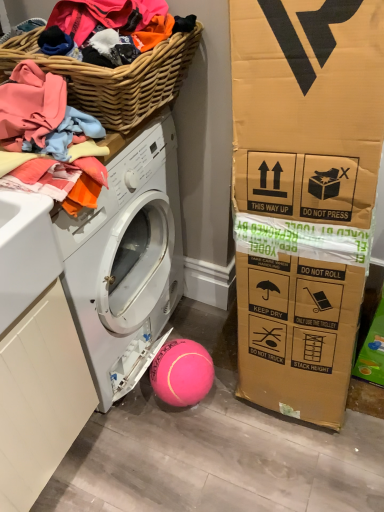
Question: Considering the relative sizes of pink rubber ball at lower center and soft cotton clothes at upper left in the image provided, is pink rubber ball at lower center bigger than soft cotton clothes at upper left?

Choices:
 (A) no
 (B) yes

Answer: (A)

Question: Would you say pink rubber ball at lower center is a long distance from soft cotton clothes at upper left?

Choices:
 (A) no
 (B) yes

Answer: (A)

Question: Does pink rubber ball at lower center have a lesser height compared to soft cotton clothes at upper left?

Choices:
 (A) no
 (B) yes

Answer: (B)

Question: From the image's perspective, is pink rubber ball at lower center on soft cotton clothes at upper left?

Choices:
 (A) no
 (B) yes

Answer: (A)

Question: Is pink rubber ball at lower center at the left side of soft cotton clothes at upper left?

Choices:
 (A) yes
 (B) no

Answer: (B)

Question: From a real-world perspective, relative to woven wood basket at upper left, is pink rubber ball at lower center vertically above or below?

Choices:
 (A) above
 (B) below

Answer: (B)

Question: Looking at their shapes, would you say pink rubber ball at lower center is wider or thinner than woven wood basket at upper left?

Choices:
 (A) thin
 (B) wide

Answer: (A)

Question: Is pink rubber ball at lower center bigger or smaller than woven wood basket at upper left?

Choices:
 (A) big
 (B) small

Answer: (B)

Question: Relative to woven wood basket at upper left, is pink rubber ball at lower center in front or behind?

Choices:
 (A) front
 (B) behind

Answer: (B)

Question: Based on their sizes in the image, would you say white matte washing machine at lower left is bigger or smaller than woven wood basket at upper left?

Choices:
 (A) big
 (B) small

Answer: (A)

Question: Looking at their shapes, would you say white matte washing machine at lower left is wider or thinner than woven wood basket at upper left?

Choices:
 (A) thin
 (B) wide

Answer: (B)

Question: Considering their positions, is white matte washing machine at lower left located in front of or behind woven wood basket at upper left?

Choices:
 (A) front
 (B) behind

Answer: (B)

Question: Based on their positions, is white matte washing machine at lower left located to the left or right of woven wood basket at upper left?

Choices:
 (A) right
 (B) left

Answer: (B)

Question: From the image's perspective, is soft cotton clothes at upper left positioned above or below white matte washing machine at lower left?

Choices:
 (A) below
 (B) above

Answer: (B)

Question: Considering the relative positions of soft cotton clothes at upper left and white matte washing machine at lower left in the image provided, is soft cotton clothes at upper left to the left or to the right of white matte washing machine at lower left?

Choices:
 (A) left
 (B) right

Answer: (B)